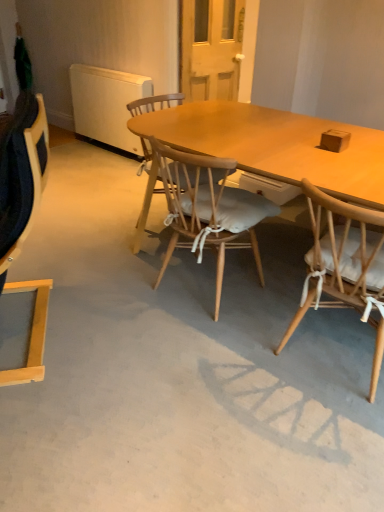
Find the location of a particular element. This screenshot has width=384, height=512. vacant area that lies between wooden chair with white cushion at right, the 3th chair from the left, and wooden chair with cushion at center, acting as the second chair starting from the right is located at coordinates (260, 316).